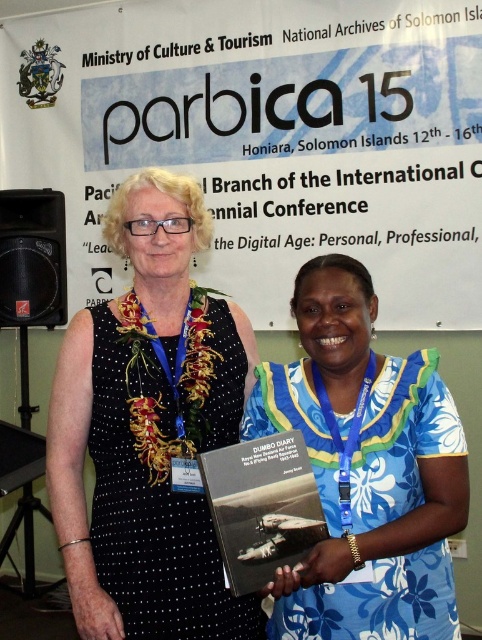
Consider the image. Is white paper at upper center closer to camera compared to black dotted dress at left?

No, it is not.

Is point (4, 144) in front of point (126, 387)?

No, it is not.

Image resolution: width=482 pixels, height=640 pixels. Describe the element at coordinates (266, 140) in the screenshot. I see `white paper at upper center` at that location.

Locate an element on the screen. white paper at upper center is located at coordinates (266, 140).

Does black dotted dress at left have a larger size compared to matte black book at center?

Indeed, black dotted dress at left has a larger size compared to matte black book at center.

Consider the image. Does black dotted dress at left lie in front of matte black book at center?

No, black dotted dress at left is further to the viewer.

Does point (188, 317) come in front of point (212, 451)?

No.

In order to click on black dotted dress at left in this screenshot , I will do `click(148, 429)`.

Does blue floral dress at center have a larger size compared to black plastic speaker at left?

Correct, blue floral dress at center is larger in size than black plastic speaker at left.

Which is behind, point (346, 497) or point (57, 314)?

The point (57, 314) is more distant.

Measure the distance between blue floral dress at center and camera.

The distance of blue floral dress at center from camera is 4.13 feet.

Where is `blue floral dress at center`? blue floral dress at center is located at coordinates (365, 468).